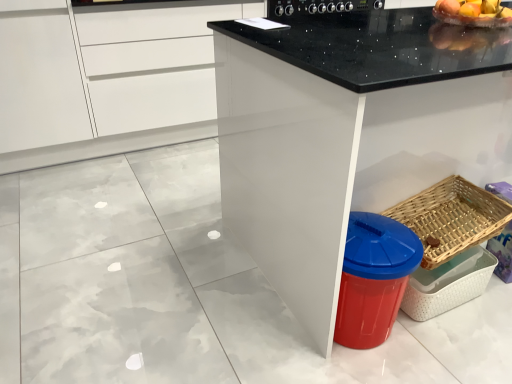
Question: Is black granite countertop at center outside woven wood basket at lower right?

Choices:
 (A) no
 (B) yes

Answer: (B)

Question: Could you tell me if black granite countertop at center is turned towards woven wood basket at lower right?

Choices:
 (A) no
 (B) yes

Answer: (B)

Question: Is black granite countertop at center turned away from woven wood basket at lower right?

Choices:
 (A) no
 (B) yes

Answer: (B)

Question: From the image's perspective, does black granite countertop at center appear higher than woven wood basket at lower right?

Choices:
 (A) no
 (B) yes

Answer: (B)

Question: Is black granite countertop at center surrounding woven wood basket at lower right?

Choices:
 (A) yes
 (B) no

Answer: (A)

Question: Would you say shiny plastic bowl at upper right is to the left or to the right of black glossy stove at upper center in the picture?

Choices:
 (A) right
 (B) left

Answer: (A)

Question: Choose the correct answer: Is shiny plastic bowl at upper right inside black glossy stove at upper center or outside it?

Choices:
 (A) outside
 (B) inside

Answer: (A)

Question: Is point (471, 16) positioned closer to the camera than point (288, 1)?

Choices:
 (A) farther
 (B) closer

Answer: (B)

Question: From the image's perspective, relative to black glossy stove at upper center, is shiny plastic bowl at upper right above or below?

Choices:
 (A) above
 (B) below

Answer: (B)

Question: Is point (324, 130) closer or farther from the camera than point (74, 137)?

Choices:
 (A) farther
 (B) closer

Answer: (B)

Question: Considering the positions of black granite countertop at center and white glossy cabinet at upper left in the image, is black granite countertop at center bigger or smaller than white glossy cabinet at upper left?

Choices:
 (A) small
 (B) big

Answer: (B)

Question: From the image's perspective, relative to white glossy cabinet at upper left, is black granite countertop at center above or below?

Choices:
 (A) above
 (B) below

Answer: (B)

Question: Is black granite countertop at center taller or shorter than white glossy cabinet at upper left?

Choices:
 (A) short
 (B) tall

Answer: (B)

Question: Relative to woven wood basket at lower right, is black granite countertop at center in front or behind?

Choices:
 (A) front
 (B) behind

Answer: (A)

Question: Considering the relative positions of black granite countertop at center and woven wood basket at lower right in the image provided, is black granite countertop at center to the left or to the right of woven wood basket at lower right?

Choices:
 (A) right
 (B) left

Answer: (A)